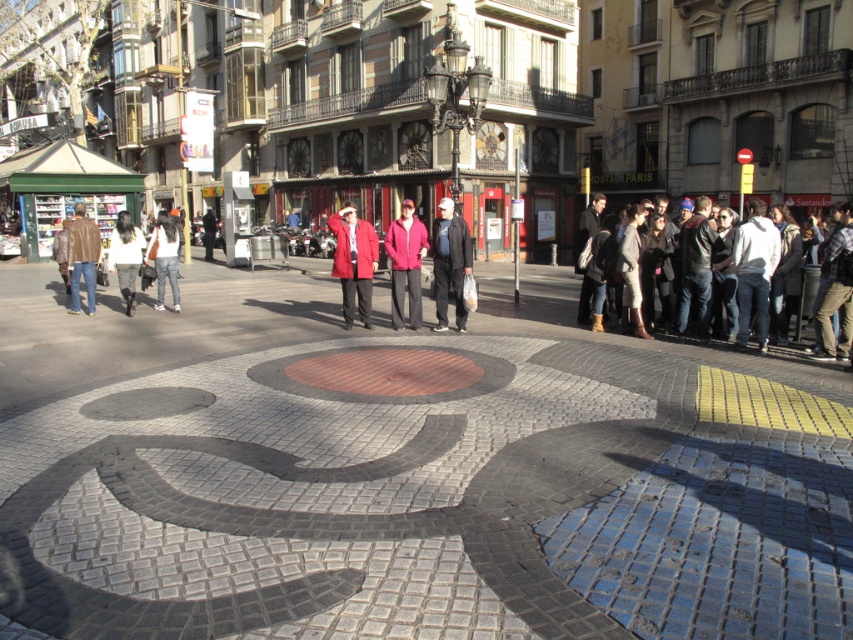
From the picture: Is matte pink jacket at center to the left of denim jacket at center from the viewer's perspective?

Incorrect, matte pink jacket at center is not on the left side of denim jacket at center.

Describe the element at coordinates (405, 264) in the screenshot. I see `matte pink jacket at center` at that location.

Locate an element on the screen. The width and height of the screenshot is (853, 640). matte pink jacket at center is located at coordinates (405, 264).

You are a GUI agent. You are given a task and a screenshot of the screen. Output one action in this format:
    pyautogui.click(x=<x>, y=<y>)
    Task: Click on the matte pink jacket at center
    The width and height of the screenshot is (853, 640).
    Given the screenshot: What is the action you would take?
    pyautogui.click(x=405, y=264)

Between brick mosaic at center and light gray sweater at right, which one appears on the left side from the viewer's perspective?

brick mosaic at center

Locate an element on the screen. The height and width of the screenshot is (640, 853). brick mosaic at center is located at coordinates (405, 472).

Is white fur coat at center smaller than denim jacket at center?

Yes, white fur coat at center is smaller than denim jacket at center.

Which is behind, point (136, 269) or point (158, 285)?

Positioned behind is point (158, 285).

Who is more distant from viewer, (135,252) or (148,257)?

Point (148,257)

Locate an element on the screen. This screenshot has height=640, width=853. white fur coat at center is located at coordinates (125, 257).